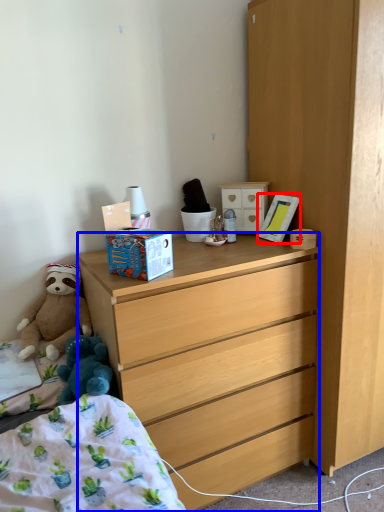
Question: Which point is further to the camera, picture frame (highlighted by a red box) or desk (highlighted by a blue box)?

Choices:
 (A) picture frame
 (B) desk

Answer: (A)